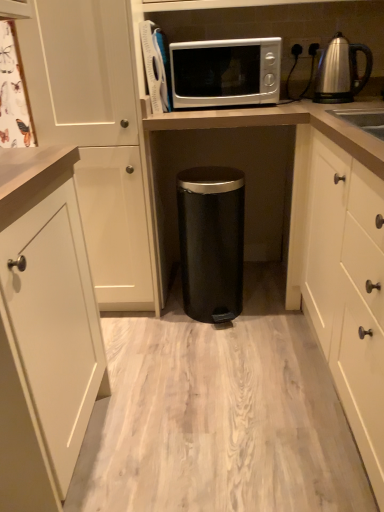
Where is `vacant position to the left of black matte trash can at center, which is counted as the second appliance, starting from the top`? The height and width of the screenshot is (512, 384). vacant position to the left of black matte trash can at center, which is counted as the second appliance, starting from the top is located at coordinates (153, 322).